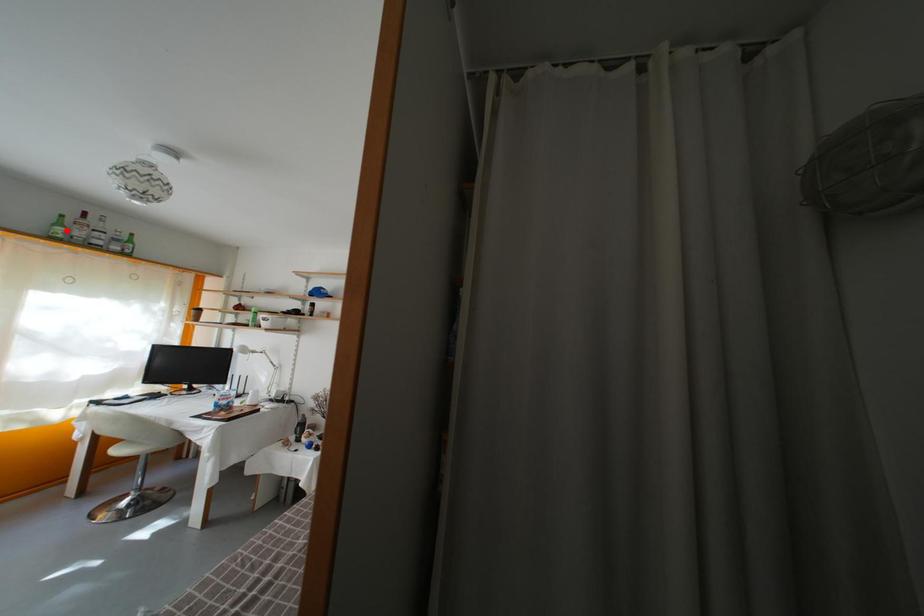
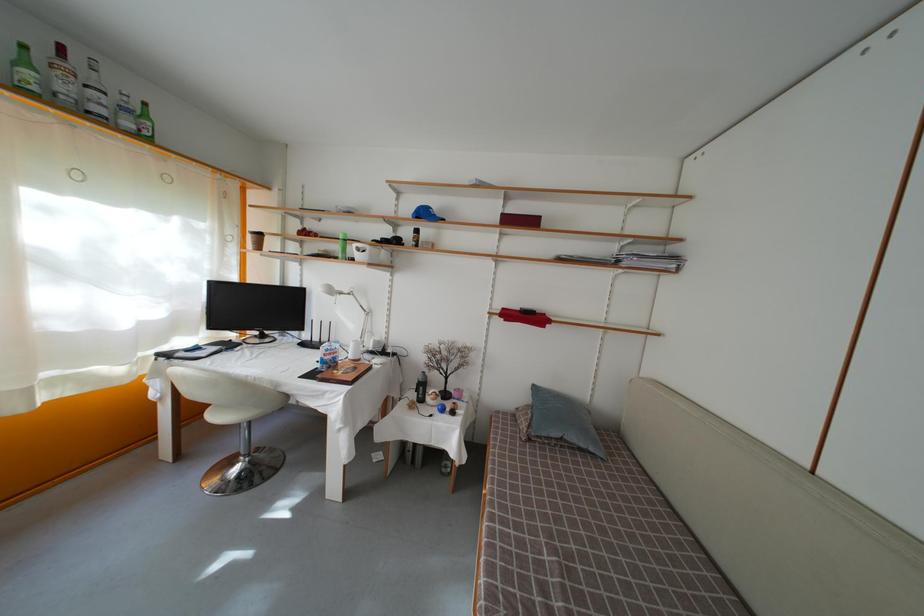
In the second image, find the point that corresponds to the highlighted location in the first image.

(31, 69)